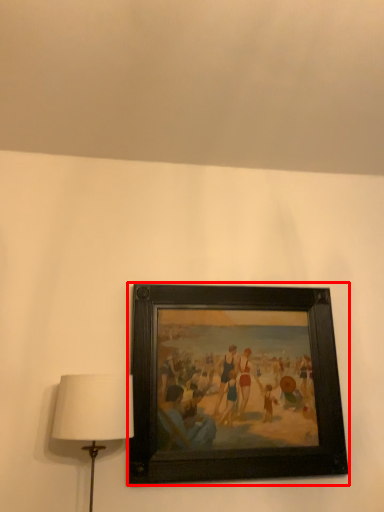
Question: From the image, what is the correct spatial relationship of picture frame (annotated by the red box) in relation to lamp?

Choices:
 (A) right
 (B) left

Answer: (A)